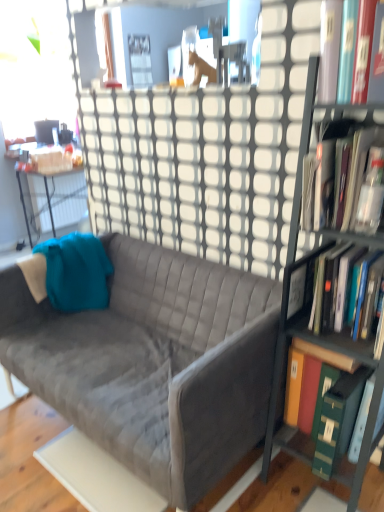
Question: In the image, is green hardcover book at right, marked as the 4th book in a top-to-bottom arrangement, on the left side or the right side of matte black desk at left?

Choices:
 (A) left
 (B) right

Answer: (B)

Question: In terms of height, does green hardcover book at right, which ranks as the first book in bottom-to-top order, look taller or shorter compared to matte black desk at left?

Choices:
 (A) short
 (B) tall

Answer: (A)

Question: Which object is positioned closest to the matte black desk at left?

Choices:
 (A) teal fabric throw pillow at left
 (B) velvet gray couch at center
 (C) green hardcover book at right, which ranks as the first book in bottom-to-top order
 (D) hardcover book at upper right, which is counted as the first book, starting from the top
 (E) hardcover book at right, marked as the second book in a bottom-to-top arrangement

Answer: (A)

Question: Which of these objects is positioned farthest from the velvet gray couch at center?

Choices:
 (A) hardcover book at right, acting as the third book starting from the top
 (B) teal fabric throw pillow at left
 (C) matte black desk at left
 (D) hardcover book at right, acting as the third book starting from the bottom
 (E) hardcover book at upper right, which is counted as the first book, starting from the top

Answer: (C)